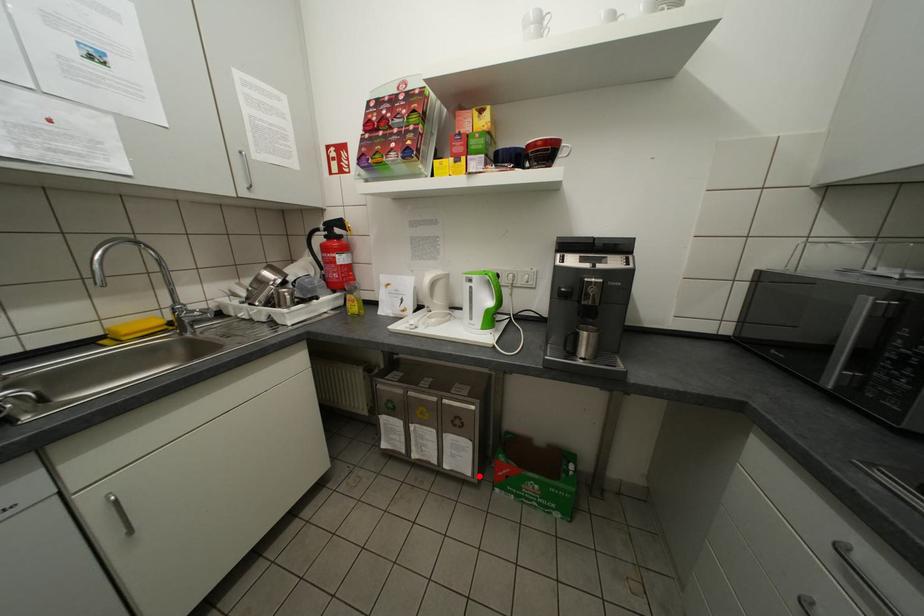
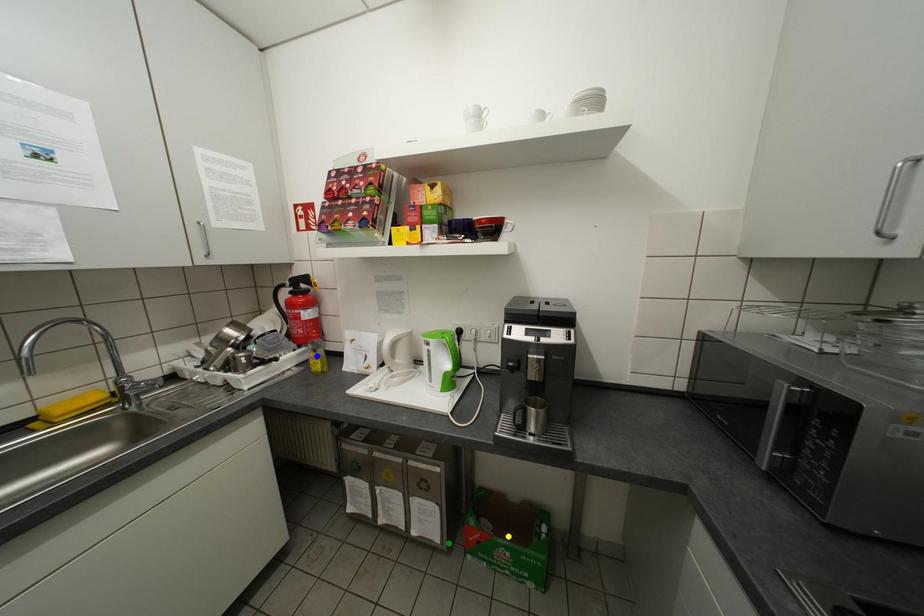
Question: I am providing you with two images of the same scene from different viewpoints. A red point is marked on the first image. You are given multiple points on the second image. Which spot in image 2 lines up with the point in image 1?

Choices:
 (A) blue point
 (B) yellow point
 (C) green point

Answer: (C)